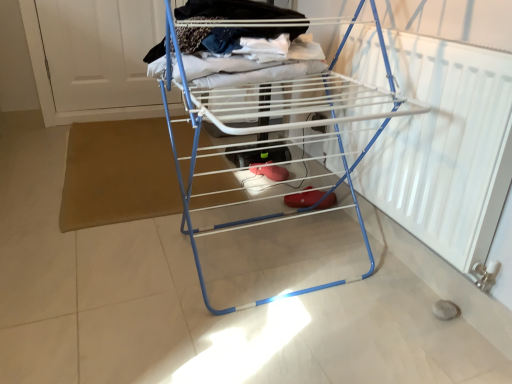
This screenshot has height=384, width=512. In order to click on free space that is to the left of blue metal drying rack at center in this screenshot , I will do `click(103, 248)`.